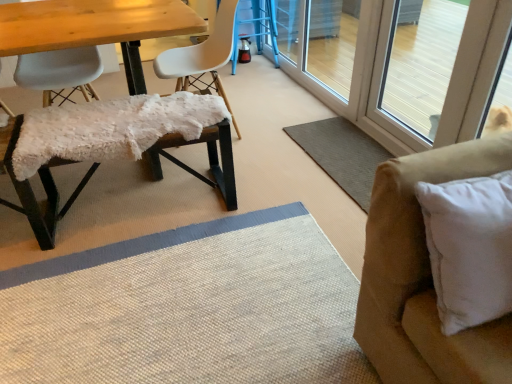
Question: From a real-world perspective, is white soft pillow at right below transparent glass screen door at upper right, which appears as the first screen door when viewed from the back?

Choices:
 (A) no
 (B) yes

Answer: (A)

Question: From the image's perspective, is white soft pillow at right on top of transparent glass screen door at upper right, which appears as the first screen door when viewed from the back?

Choices:
 (A) no
 (B) yes

Answer: (A)

Question: Is white soft pillow at right positioned in front of transparent glass screen door at upper right, marked as the second screen door in a front-to-back arrangement?

Choices:
 (A) yes
 (B) no

Answer: (A)

Question: Could you tell me if white soft pillow at right is turned towards transparent glass screen door at upper right, marked as the second screen door in a front-to-back arrangement?

Choices:
 (A) yes
 (B) no

Answer: (B)

Question: Does white soft pillow at right have a greater height compared to transparent glass screen door at upper right, marked as the second screen door in a front-to-back arrangement?

Choices:
 (A) yes
 (B) no

Answer: (B)

Question: From the image's perspective, is suede beige couch at right positioned above or below white fluffy bench at left, marked as the second chair in a left-to-right arrangement?

Choices:
 (A) below
 (B) above

Answer: (A)

Question: Is suede beige couch at right in front of or behind white fluffy bench at left, marked as the second chair in a left-to-right arrangement, in the image?

Choices:
 (A) behind
 (B) front

Answer: (B)

Question: Considering the relative positions of suede beige couch at right and white fluffy bench at left, arranged as the 2th chair when viewed from the right, in the image provided, is suede beige couch at right to the left or to the right of white fluffy bench at left, arranged as the 2th chair when viewed from the right,?

Choices:
 (A) left
 (B) right

Answer: (B)

Question: Does point (414, 324) appear closer or farther from the camera than point (196, 139)?

Choices:
 (A) farther
 (B) closer

Answer: (B)

Question: From a real-world perspective, is white matte chair at center, which is the 1th chair in right-to-left order, physically located above or below white soft pillow at right?

Choices:
 (A) above
 (B) below

Answer: (B)

Question: In the image, is white matte chair at center, the third chair when ordered from left to right, on the left side or the right side of white soft pillow at right?

Choices:
 (A) left
 (B) right

Answer: (A)

Question: From the image's perspective, is white matte chair at center, which is the 1th chair in right-to-left order, located above or below white soft pillow at right?

Choices:
 (A) above
 (B) below

Answer: (A)

Question: Based on their sizes in the image, would you say white matte chair at center, which is the 1th chair in right-to-left order, is bigger or smaller than white soft pillow at right?

Choices:
 (A) small
 (B) big

Answer: (B)

Question: Considering their positions, is matte white plastic chair at left, marked as the 1th chair in a left-to-right arrangement, located in front of or behind white soft pillow at right?

Choices:
 (A) front
 (B) behind

Answer: (B)

Question: Looking at their shapes, would you say matte white plastic chair at left, the 3th chair viewed from the right, is wider or thinner than white soft pillow at right?

Choices:
 (A) thin
 (B) wide

Answer: (B)